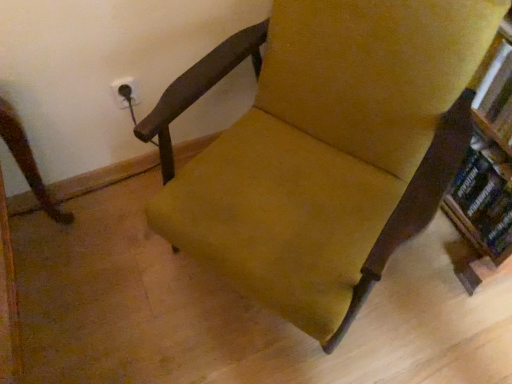
The image size is (512, 384). What do you see at coordinates (483, 200) in the screenshot? I see `hardcover book at right` at bounding box center [483, 200].

What is the approximate height of hardcover book at right?

10.58 inches.

Locate an element on the screen. Image resolution: width=512 pixels, height=384 pixels. hardcover book at right is located at coordinates (483, 200).

This screenshot has height=384, width=512. Find the location of `velvet yellow chair at center`. velvet yellow chair at center is located at coordinates (324, 149).

Image resolution: width=512 pixels, height=384 pixels. Describe the element at coordinates (324, 149) in the screenshot. I see `velvet yellow chair at center` at that location.

What is the approximate height of velvet yellow chair at center?

The height of velvet yellow chair at center is 31.45 inches.

In order to face velvet yellow chair at center, should I rotate leftwards or rightwards?

Turn right approximately 7.147 degrees to face it.

Locate an element on the screen. The width and height of the screenshot is (512, 384). hardcover book at right is located at coordinates (483, 200).

Which is more to the left, hardcover book at right or velvet yellow chair at center?

velvet yellow chair at center is more to the left.

Which object is further away from the camera taking this photo, hardcover book at right or velvet yellow chair at center?

hardcover book at right is more distant.

Does point (500, 242) lie behind point (282, 256)?

Yes, it is.

From the image's perspective, which one is positioned lower, hardcover book at right or velvet yellow chair at center?

hardcover book at right appears lower in the image.

From a real-world perspective, does hardcover book at right stand above velvet yellow chair at center?

No.

Considering the relative sizes of hardcover book at right and velvet yellow chair at center in the image provided, is hardcover book at right thinner than velvet yellow chair at center?

Yes, hardcover book at right is thinner than velvet yellow chair at center.

Considering the sizes of objects hardcover book at right and velvet yellow chair at center in the image provided, who is shorter, hardcover book at right or velvet yellow chair at center?

Standing shorter between the two is hardcover book at right.

Is hardcover book at right bigger or smaller than velvet yellow chair at center?

hardcover book at right is smaller than velvet yellow chair at center.

Could velvet yellow chair at center be considered to be inside hardcover book at right?

No, velvet yellow chair at center is not inside hardcover book at right.

Is hardcover book at right far away from velvet yellow chair at center?

hardcover book at right is actually quite close to velvet yellow chair at center.

Could you tell me if hardcover book at right is turned towards velvet yellow chair at center?

Yes, hardcover book at right is aimed at velvet yellow chair at center.

How distant is hardcover book at right from velvet yellow chair at center?

hardcover book at right and velvet yellow chair at center are 20.07 inches apart.

The image size is (512, 384). Find the location of `book below the velvet yellow chair at center (from a real-world perspective)`. book below the velvet yellow chair at center (from a real-world perspective) is located at coordinates (483, 200).

Considering the relative positions of velvet yellow chair at center and hardcover book at right in the image provided, is velvet yellow chair at center to the left of hardcover book at right from the viewer's perspective?

Yes, velvet yellow chair at center is to the left of hardcover book at right.

Is velvet yellow chair at center in front of or behind hardcover book at right in the image?

In the image, velvet yellow chair at center appears in front of hardcover book at right.

Which is behind, point (304, 20) or point (479, 218)?

The point (479, 218) is behind.

From the image's perspective, is velvet yellow chair at center under hardcover book at right?

No, from the image's perspective, velvet yellow chair at center is not beneath hardcover book at right.

Looking at this image, from a real-world perspective, who is located lower, velvet yellow chair at center or hardcover book at right?

In real-world perspective, hardcover book at right is lower.

Looking at their sizes, would you say velvet yellow chair at center is wider or thinner than hardcover book at right?

Clearly, velvet yellow chair at center has more width compared to hardcover book at right.

Does velvet yellow chair at center have a lesser height compared to hardcover book at right?

No, velvet yellow chair at center is not shorter than hardcover book at right.

Consider the image. Who is smaller, velvet yellow chair at center or hardcover book at right?

Smaller between the two is hardcover book at right.

Is velvet yellow chair at center spatially inside hardcover book at right, or outside of it?

velvet yellow chair at center lies outside hardcover book at right.

Is velvet yellow chair at center in contact with hardcover book at right?

No, velvet yellow chair at center is not beside hardcover book at right.

Is velvet yellow chair at center oriented away from hardcover book at right?

No, hardcover book at right is not at the back of velvet yellow chair at center.

How many degrees apart are the facing directions of velvet yellow chair at center and hardcover book at right?

28.6 degrees separate the facing orientations of velvet yellow chair at center and hardcover book at right.

The height and width of the screenshot is (384, 512). Identify the location of book on the right of velvet yellow chair at center. (483, 200).

The height and width of the screenshot is (384, 512). There is a hardcover book at right. In order to click on chair above it (from a real-world perspective) in this screenshot , I will do `click(324, 149)`.

Where is `book that appears on the right of velvet yellow chair at center`? This screenshot has height=384, width=512. book that appears on the right of velvet yellow chair at center is located at coordinates (x=483, y=200).